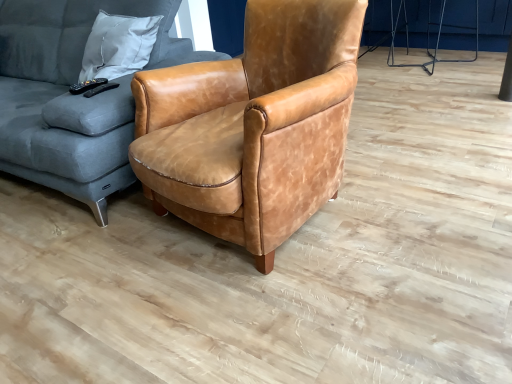
Question: From a real-world perspective, is matte brown leather armchair at center beneath metallic silver tripod at upper right?

Choices:
 (A) yes
 (B) no

Answer: (B)

Question: Can you confirm if matte brown leather armchair at center is shorter than metallic silver tripod at upper right?

Choices:
 (A) yes
 (B) no

Answer: (B)

Question: Does matte brown leather armchair at center have a lesser width compared to metallic silver tripod at upper right?

Choices:
 (A) no
 (B) yes

Answer: (A)

Question: Is matte brown leather armchair at center looking in the opposite direction of metallic silver tripod at upper right?

Choices:
 (A) no
 (B) yes

Answer: (B)

Question: Is matte brown leather armchair at center behind metallic silver tripod at upper right?

Choices:
 (A) no
 (B) yes

Answer: (A)

Question: In terms of height, does velvet grey couch at left look taller or shorter compared to metallic silver tripod at upper right?

Choices:
 (A) short
 (B) tall

Answer: (B)

Question: From a real-world perspective, is velvet grey couch at left physically located above or below metallic silver tripod at upper right?

Choices:
 (A) above
 (B) below

Answer: (A)

Question: Considering the positions of velvet grey couch at left and metallic silver tripod at upper right in the image, is velvet grey couch at left bigger or smaller than metallic silver tripod at upper right?

Choices:
 (A) small
 (B) big

Answer: (B)

Question: Would you say velvet grey couch at left is to the left or to the right of metallic silver tripod at upper right in the picture?

Choices:
 (A) right
 (B) left

Answer: (B)

Question: From a real-world perspective, relative to velvet grey couch at left, is metallic silver tripod at upper right vertically above or below?

Choices:
 (A) above
 (B) below

Answer: (B)

Question: Do you think metallic silver tripod at upper right is within velvet grey couch at left, or outside of it?

Choices:
 (A) outside
 (B) inside

Answer: (A)

Question: Based on their positions, is metallic silver tripod at upper right located to the left or right of velvet grey couch at left?

Choices:
 (A) left
 (B) right

Answer: (B)

Question: Relative to velvet grey couch at left, is metallic silver tripod at upper right in front or behind?

Choices:
 (A) behind
 (B) front

Answer: (A)

Question: Which is correct: matte brown leather armchair at center is inside velvet grey couch at left, or outside of it?

Choices:
 (A) inside
 (B) outside

Answer: (B)

Question: In the image, is matte brown leather armchair at center positioned in front of or behind velvet grey couch at left?

Choices:
 (A) front
 (B) behind

Answer: (A)